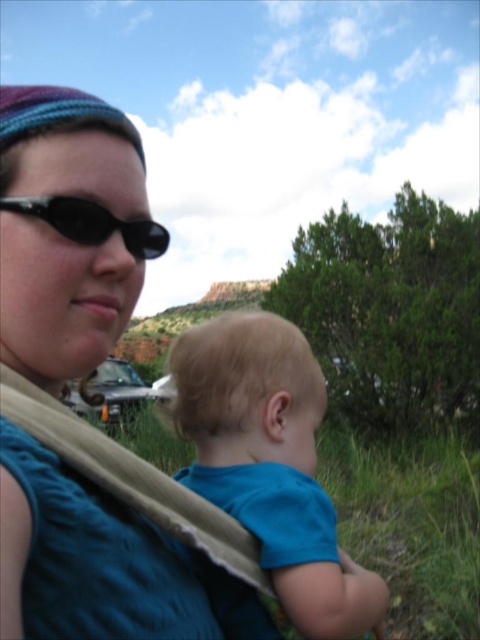
Question: Considering the real-world distances, which object is closest to the blue knitted hat at upper left?

Choices:
 (A) black matte sunglasses at upper left
 (B) blue soft fabric toddler at center

Answer: (A)

Question: Which point appears closest to the camera in this image?

Choices:
 (A) (304, 476)
 (B) (84, 198)

Answer: (B)

Question: Can you confirm if blue knitted hat at upper left is positioned below black matte sunglasses at upper left?

Choices:
 (A) yes
 (B) no

Answer: (A)

Question: Is blue soft fabric toddler at center to the right of black matte sunglasses at upper left from the viewer's perspective?

Choices:
 (A) no
 (B) yes

Answer: (B)

Question: Can you confirm if blue knitted hat at upper left is bigger than black matte sunglasses at upper left?

Choices:
 (A) yes
 (B) no

Answer: (A)

Question: Based on their relative distances, which object is farther from the black matte sunglasses at upper left?

Choices:
 (A) blue soft fabric toddler at center
 (B) blue knitted hat at upper left

Answer: (A)